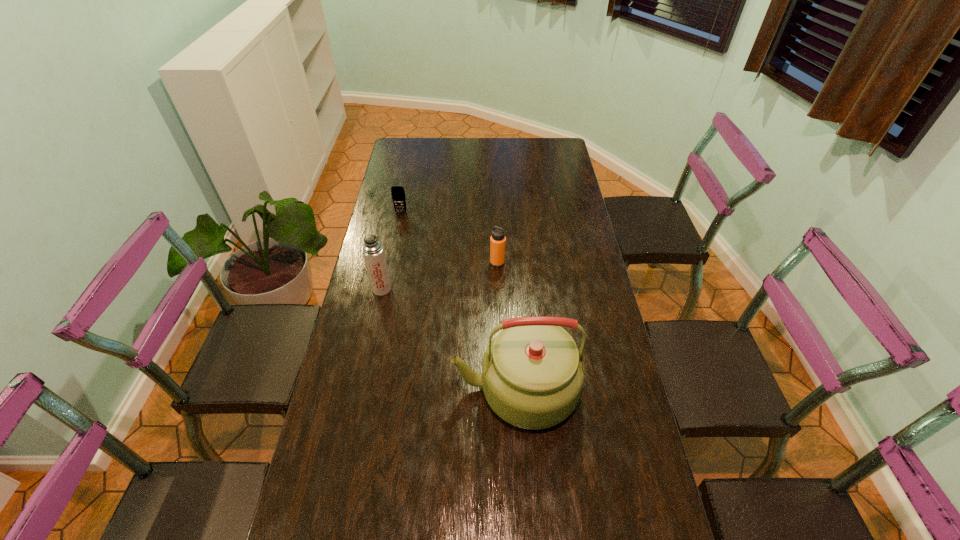
Identify the location of vacant space located 0.160m at the spout of the tallest object. The image size is (960, 540). (396, 389).

This screenshot has height=540, width=960. Find the location of `free space located 0.140m on the front of the third shortest object`. free space located 0.140m on the front of the third shortest object is located at coordinates (373, 329).

This screenshot has width=960, height=540. I want to click on free space located on the front of the right thermos bottle, so (498, 280).

You are a GUI agent. You are given a task and a screenshot of the screen. Output one action in this format:
    pyautogui.click(x=<x>, y=<y>)
    Task: Click on the blank area located on the screen of the shortest object
    Image resolution: width=960 pixels, height=540 pixels.
    Given the screenshot: What is the action you would take?
    pyautogui.click(x=399, y=221)

Locate an element on the screen. The width and height of the screenshot is (960, 540). thermos bottle at the left edge is located at coordinates (373, 252).

You are a GUI agent. You are given a task and a screenshot of the screen. Output one action in this format:
    pyautogui.click(x=<x>, y=<y>)
    Task: Click on the cellular telephone situated at the left edge
    This screenshot has height=540, width=960.
    Given the screenshot: What is the action you would take?
    pyautogui.click(x=397, y=192)

At what (x,y) coordinates should I click in order to perform the action: click on object that is positioned at the right edge. Please return your answer as a coordinate pair (x, y). The width and height of the screenshot is (960, 540). Looking at the image, I should click on (532, 375).

I want to click on vacant region at the far edge of the desktop, so click(490, 158).

Identify the location of free region at the left edge of the desktop. The image size is (960, 540). (372, 426).

Image resolution: width=960 pixels, height=540 pixels. In order to click on free spot at the right edge of the desktop in this screenshot , I will do `click(564, 274)`.